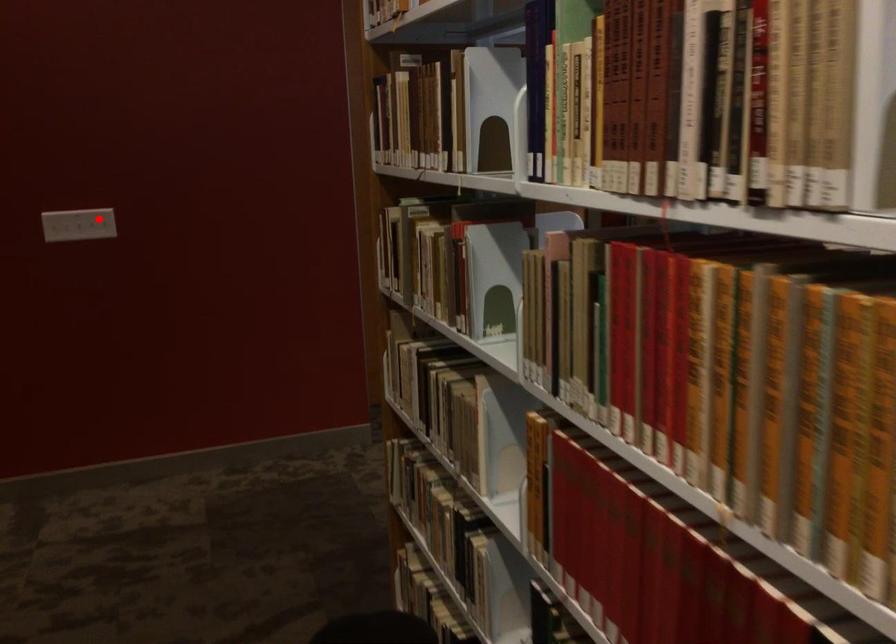
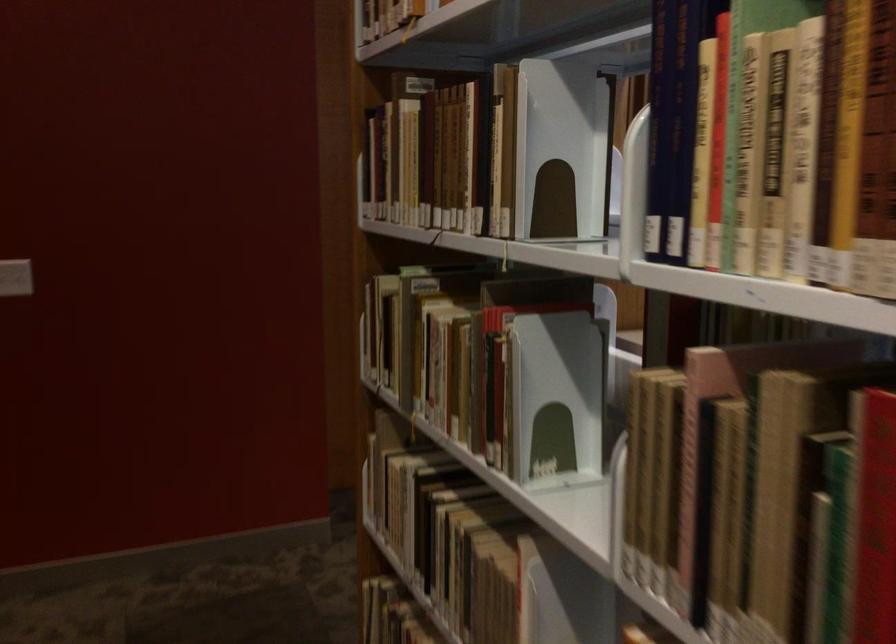
Question: I am providing you with two images of the same scene from different viewpoints. A red point is shown in image1. For the corresponding object point in image2, is it positioned nearer or farther from the camera?

Choices:
 (A) Nearer
 (B) Farther

Answer: (A)